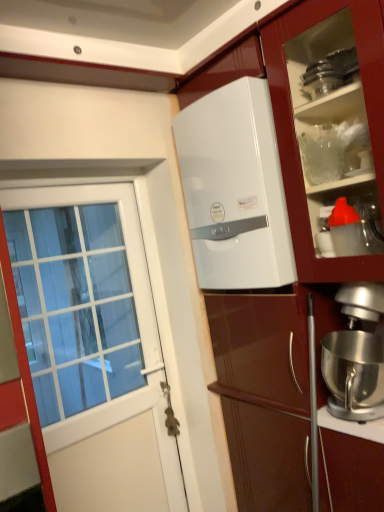
Measure the distance between point (200, 250) and camera.

A distance of 1.74 meters exists between point (200, 250) and camera.

What do you see at coordinates (98, 355) in the screenshot?
I see `white glossy door at left` at bounding box center [98, 355].

Measure the distance between silver metallic stand mixer at lower right and camera.

silver metallic stand mixer at lower right and camera are 4.10 feet apart from each other.

At what (x,y) coordinates should I click in order to perform the action: click on white glossy water heater at upper center. Please return your answer as a coordinate pair (x, y). This screenshot has height=512, width=384. Looking at the image, I should click on (235, 189).

Between white glossy water heater at upper center and silver metallic stand mixer at lower right, which one has more height?

white glossy water heater at upper center.

Which object is closer to the camera, white glossy water heater at upper center or silver metallic stand mixer at lower right?

silver metallic stand mixer at lower right is in front.

In the scene shown: Can silver metallic stand mixer at lower right be found inside white glossy water heater at upper center?

Definitely not — silver metallic stand mixer at lower right is not inside white glossy water heater at upper center.

From the picture: From the image's perspective, would you say white glossy water heater at upper center is shown under silver metallic stand mixer at lower right?

No.

Considering the positions of objects white glossy water heater at upper center and white glossy refrigerator at center in the image provided, who is behind, white glossy water heater at upper center or white glossy refrigerator at center?

Positioned behind is white glossy water heater at upper center.

Considering the positions of points (251, 271) and (210, 290), is point (251, 271) farther from camera compared to point (210, 290)?

No, (251, 271) is closer to viewer.

What's the angular difference between white glossy water heater at upper center and white glossy refrigerator at center's facing directions?

The facing directions of white glossy water heater at upper center and white glossy refrigerator at center are 1.24 degrees apart.

Would you say white glossy water heater at upper center is a long distance from white glossy refrigerator at center?

white glossy water heater at upper center is actually quite close to white glossy refrigerator at center.

Measure the distance from white glossy door at left to metallic silver door handle at lower center.

white glossy door at left is 21.02 inches from metallic silver door handle at lower center.

Is point (87, 420) more distant than point (171, 423)?

No, it is in front of (171, 423).

From a real-world perspective, is white glossy door at left positioned under metallic silver door handle at lower center based on gravity?

No, from a real-world perspective, white glossy door at left is not beneath metallic silver door handle at lower center.

Is the surface of white glossy door at left in direct contact with metallic silver door handle at lower center?

There is a gap between white glossy door at left and metallic silver door handle at lower center.

Are white glossy door at left and silver metallic stand mixer at lower right located far from each other?

white glossy door at left is positioned a significant distance from silver metallic stand mixer at lower right.

Considering the positions of point (95, 275) and point (353, 400), is point (95, 275) closer or farther from the camera than point (353, 400)?

Clearly, point (95, 275) is more distant from the camera than point (353, 400).

Which object is wider, white glossy door at left or silver metallic stand mixer at lower right?

silver metallic stand mixer at lower right is wider.

Choose the correct answer: Is white glossy door at left inside silver metallic stand mixer at lower right or outside it?

white glossy door at left exists outside the volume of silver metallic stand mixer at lower right.

Based on the photo, which object is closer to the camera taking this photo, metallic silver door handle at lower center or silver metallic stand mixer at lower right?

silver metallic stand mixer at lower right.

Is there a large distance between metallic silver door handle at lower center and silver metallic stand mixer at lower right?

metallic silver door handle at lower center is actually quite close to silver metallic stand mixer at lower right.

Can you confirm if metallic silver door handle at lower center is shorter than silver metallic stand mixer at lower right?

Yes, metallic silver door handle at lower center is shorter than silver metallic stand mixer at lower right.

Is point (167, 431) positioned in front of point (379, 371)?

No, (167, 431) is further to viewer.

Based on the photo, between white glossy refrigerator at center and silver metallic stand mixer at lower right, which one has more height?

Standing taller between the two is white glossy refrigerator at center.

Does white glossy refrigerator at center turn towards silver metallic stand mixer at lower right?

No, white glossy refrigerator at center is not oriented towards silver metallic stand mixer at lower right.

Considering the sizes of objects white glossy refrigerator at center and silver metallic stand mixer at lower right in the image provided, who is bigger, white glossy refrigerator at center or silver metallic stand mixer at lower right?

With larger size is white glossy refrigerator at center.

How much distance is there between white glossy refrigerator at center and silver metallic stand mixer at lower right?

A distance of 11.04 inches exists between white glossy refrigerator at center and silver metallic stand mixer at lower right.

Which object is positioned more to the right, silver metallic stand mixer at lower right or white glossy door at left?

From the viewer's perspective, silver metallic stand mixer at lower right appears more on the right side.

Would you say silver metallic stand mixer at lower right contains white glossy door at left?

No, white glossy door at left is not inside silver metallic stand mixer at lower right.

Is silver metallic stand mixer at lower right in contact with white glossy door at left?

No, silver metallic stand mixer at lower right is not in contact with white glossy door at left.

At what (x,y) coordinates should I click in order to perform the action: click on kitchen appliance that is under the white glossy water heater at upper center (from a real-world perspective). Please return your answer as a coordinate pair (x, y). The width and height of the screenshot is (384, 512). Looking at the image, I should click on (355, 356).

Where is `cabinetry lying on the right of white glossy water heater at upper center`? This screenshot has height=512, width=384. cabinetry lying on the right of white glossy water heater at upper center is located at coordinates (282, 238).

Based on their spatial positions, is white glossy water heater at upper center or white glossy refrigerator at center further from metallic silver door handle at lower center?

Based on the image, white glossy water heater at upper center appears to be further to metallic silver door handle at lower center.

Estimate the real-world distances between objects in this image. Which object is closer to white glossy water heater at upper center, metallic silver door handle at lower center or white glossy refrigerator at center?

white glossy refrigerator at center.

Estimate the real-world distances between objects in this image. Which object is closer to white glossy door at left, white glossy water heater at upper center or white glossy refrigerator at center?

The object closer to white glossy door at left is white glossy refrigerator at center.

Looking at the image, which one is located closer to silver metallic stand mixer at lower right, metallic silver door handle at lower center or white glossy water heater at upper center?

The object closer to silver metallic stand mixer at lower right is white glossy water heater at upper center.

Which object lies further to the anchor point white glossy door at left, metallic silver door handle at lower center or silver metallic stand mixer at lower right?

The object further to white glossy door at left is silver metallic stand mixer at lower right.

Which object lies further to the anchor point white glossy door at left, metallic silver door handle at lower center or white glossy refrigerator at center?

white glossy refrigerator at center lies further to white glossy door at left than the other object.

Based on their spatial positions, is white glossy door at left or white glossy water heater at upper center closer to silver metallic stand mixer at lower right?

white glossy water heater at upper center.

Considering their positions, is white glossy door at left positioned closer to metallic silver door handle at lower center than silver metallic stand mixer at lower right?

Among the two, white glossy door at left is located nearer to metallic silver door handle at lower center.

Find the location of a particular element. Image resolution: width=384 pixels, height=512 pixels. home appliance between white glossy door at left and silver metallic stand mixer at lower right from left to right is located at coordinates [x=235, y=189].

Locate an element on the screen. The height and width of the screenshot is (512, 384). door between white glossy water heater at upper center and metallic silver door handle at lower center in the vertical direction is located at coordinates (98, 355).

The width and height of the screenshot is (384, 512). In order to click on door handle located between white glossy door at left and silver metallic stand mixer at lower right in the left-right direction in this screenshot , I will do `click(170, 412)`.

Where is `kitchen appliance between white glossy water heater at upper center and metallic silver door handle at lower center from top to bottom`? This screenshot has height=512, width=384. kitchen appliance between white glossy water heater at upper center and metallic silver door handle at lower center from top to bottom is located at coordinates (355, 356).